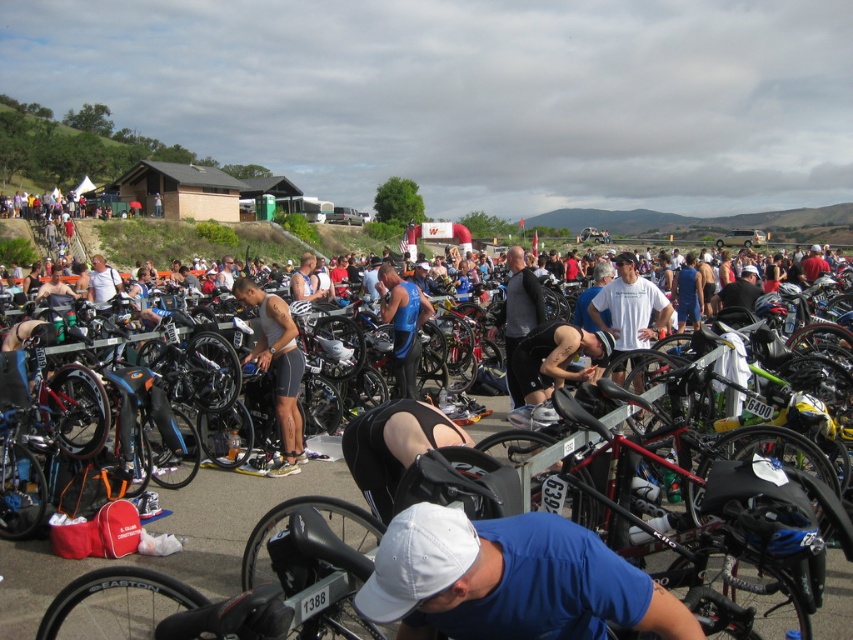
Question: Is blue fabric shirt at center above blue fabric tank top at center?

Choices:
 (A) no
 (B) yes

Answer: (A)

Question: Among these points, which one is nearest to the camera?

Choices:
 (A) (398, 316)
 (B) (511, 320)
 (C) (364, 472)

Answer: (C)

Question: Is blue fabric tank top at center thinner than black matte vest at center?

Choices:
 (A) yes
 (B) no

Answer: (A)

Question: Which object is positioned farthest from the blue fabric tank top at center?

Choices:
 (A) black matte shorts at center
 (B) black matte vest at center

Answer: (A)

Question: Can you confirm if blue fabric tank top at center is positioned below black matte vest at center?

Choices:
 (A) no
 (B) yes

Answer: (B)

Question: Which of these objects is positioned closest to the blue fabric tank top at center?

Choices:
 (A) black matte vest at center
 (B) black matte shorts at center

Answer: (A)